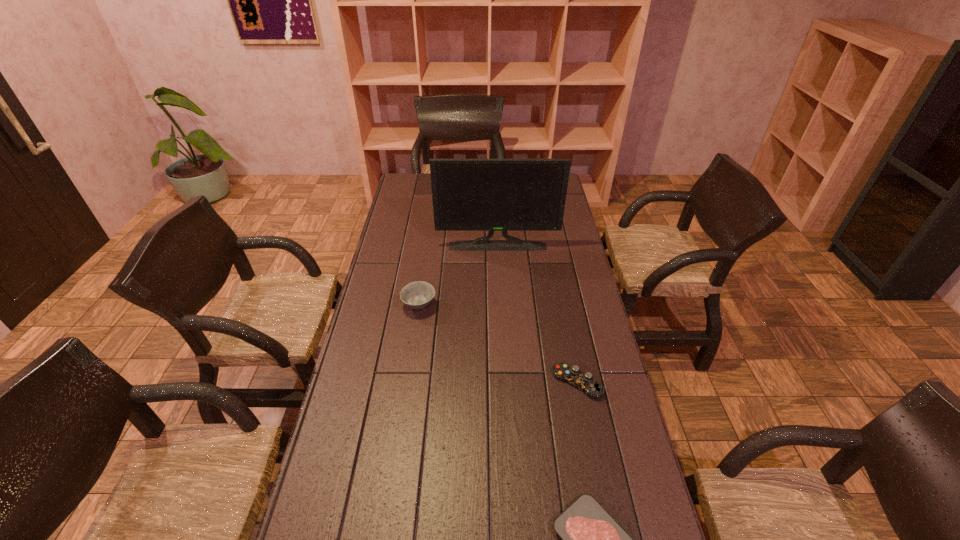
The image size is (960, 540). I want to click on monitor, so click(x=491, y=195).

The image size is (960, 540). I want to click on the farthest object, so click(x=491, y=195).

Where is `the third nearest object`? The height and width of the screenshot is (540, 960). the third nearest object is located at coordinates (417, 295).

The image size is (960, 540). I want to click on the third shortest object, so click(417, 295).

Find the location of `control`. control is located at coordinates (584, 381).

At what (x,y) coordinates should I click in order to perform the action: click on the third tallest object. Please return your answer as a coordinate pair (x, y). Looking at the image, I should click on (584, 381).

Where is `blank space located on the front-facing side of the tallest object`? blank space located on the front-facing side of the tallest object is located at coordinates (499, 287).

Where is `free space located on the right of the third shortest object`? This screenshot has height=540, width=960. free space located on the right of the third shortest object is located at coordinates (468, 306).

Where is `vacant space located 0.280m on the left of the second shortest object`? Image resolution: width=960 pixels, height=540 pixels. vacant space located 0.280m on the left of the second shortest object is located at coordinates (460, 383).

Where is `object that is at the left edge`? object that is at the left edge is located at coordinates (417, 295).